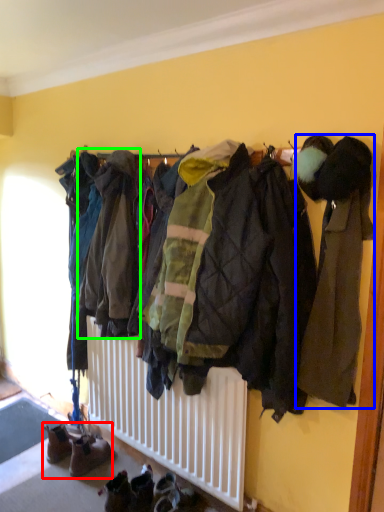
Question: Which object is the farthest from footwear (highlighted by a red box)? Choose among these: jacket (highlighted by a blue box) or jacket (highlighted by a green box).

Choices:
 (A) jacket
 (B) jacket

Answer: (A)